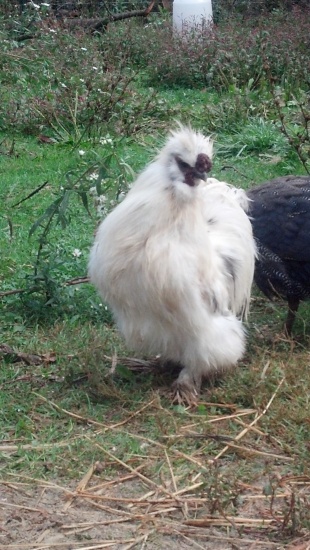
This screenshot has width=310, height=550. I want to click on white bucket, so click(184, 8).